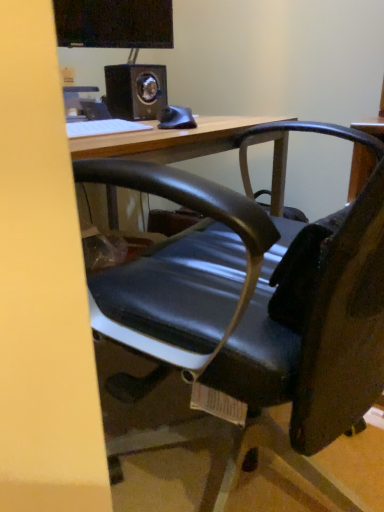
Find the location of a particular element. empty space that is ontop of white matte keyboard at upper left (from a real-world perspective) is located at coordinates (94, 122).